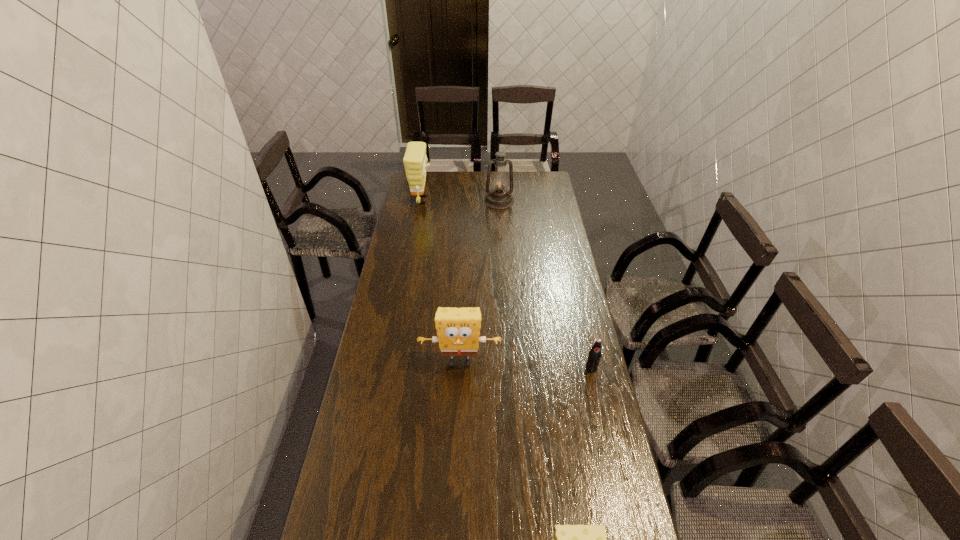
Point out which sponge is positioned as the second nearest to the nearest object. Please provide its 2D coordinates. Your answer should be formatted as a tuple, i.e. [(x, y)], where the tuple contains the x and y coordinates of a point satisfying the conditions above.

[(415, 159)]

At what (x,y) coordinates should I click in order to perform the action: click on free spot that satisfies the following two spatial constraints: 1. on the face of the oil lamp; 2. on the left side of the leftmost object. Please return your answer as a coordinate pair (x, y). Looking at the image, I should click on [421, 200].

You are a GUI agent. You are given a task and a screenshot of the screen. Output one action in this format:
    pyautogui.click(x=<x>, y=<y>)
    Task: Click on the free space that satisfies the following two spatial constraints: 1. on the face of the leftmost object; 2. on the back side of the oil lamp
    The width and height of the screenshot is (960, 540).
    Given the screenshot: What is the action you would take?
    pyautogui.click(x=421, y=200)